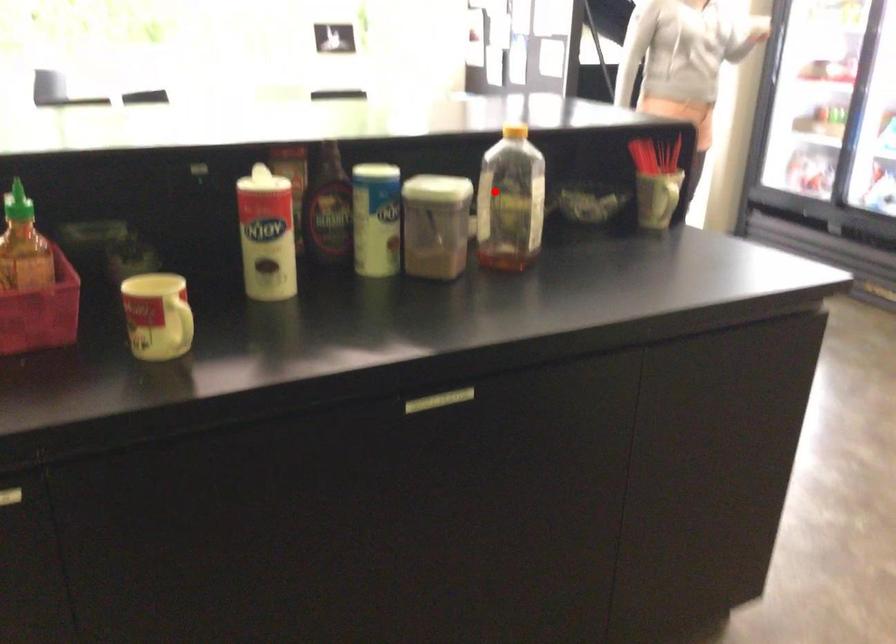
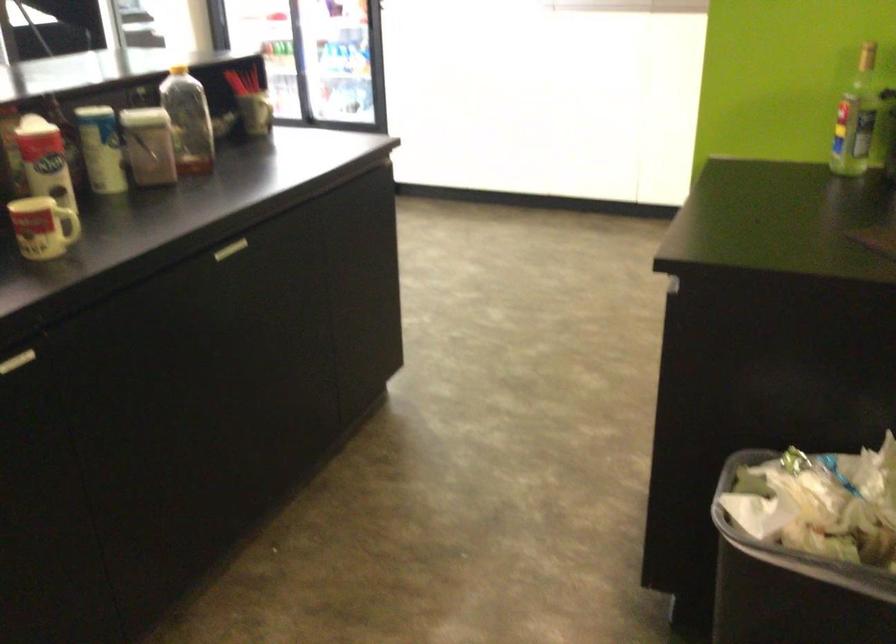
Question: A red point is marked in image1. In image2, is the corresponding 3D point closer to the camera or farther? Reply with the corresponding letter.

Choices:
 (A) The corresponding 3D point is closer.
 (B) The corresponding 3D point is farther.

Answer: (B)